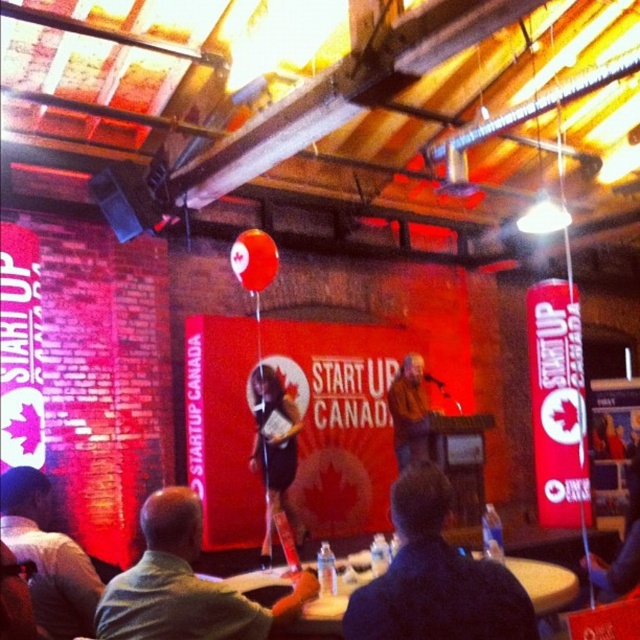
Does dark blue shirt at center come in front of brown leather jacket at center?

Yes.

Is dark blue shirt at center shorter than brown leather jacket at center?

Yes.

Does point (408, 508) come in front of point (412, 378)?

Yes, point (408, 508) is closer to viewer.

Where is `dark blue shirt at center`? The width and height of the screenshot is (640, 640). dark blue shirt at center is located at coordinates (435, 579).

Is point (266, 448) positioned before point (417, 362)?

That is True.

Is the position of black leather dress at center less distant than that of brown leather jacket at center?

Yes, black leather dress at center is closer to the viewer.

Is point (278, 390) more distant than point (413, 420)?

No, it is in front of (413, 420).

At what (x,y) coordinates should I click in order to perform the action: click on black leather dress at center. Please return your answer as a coordinate pair (x, y). This screenshot has height=640, width=640. Looking at the image, I should click on (275, 449).

Who is more distant from viewer, (x=486, y=577) or (x=259, y=401)?

The point (x=259, y=401) is behind.

How much distance is there between dark blue shirt at center and black leather dress at center?

A distance of 10.36 feet exists between dark blue shirt at center and black leather dress at center.

Locate an element on the screen. dark blue shirt at center is located at coordinates (435, 579).